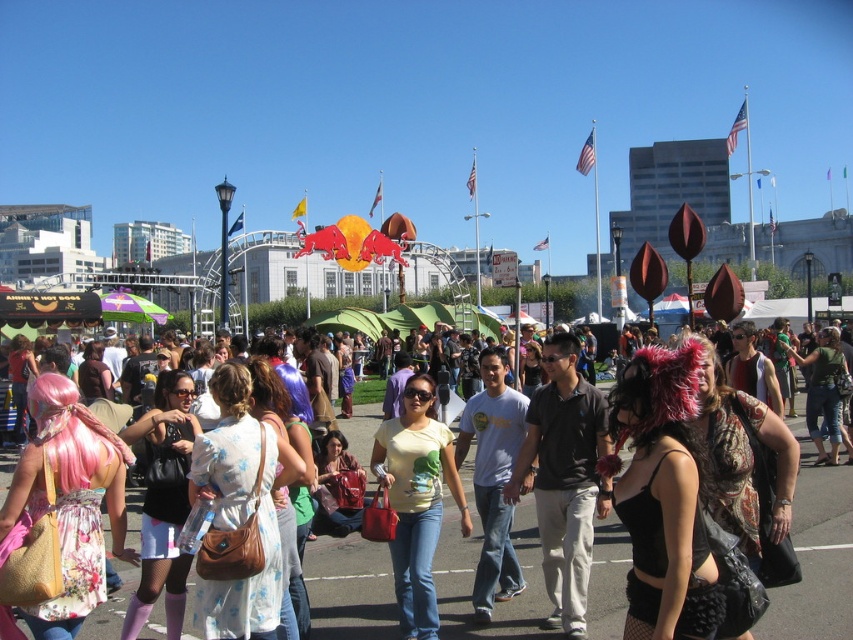
You are organizing a photo shoot and need to place two models wearing the dark gray polo shirt at center and the yellow matte shirt at center in a way that their outfits are clearly visible. Given their sizes, which model should you position closer to the camera to ensure their outfit details are captured well?

The dark gray polo shirt at center occupies less space than the yellow matte shirt at center. To ensure both outfits are clearly visible, position the model wearing the dark gray polo shirt at center closer to the camera since it is smaller and requires more focus to capture details, while the larger yellow matte shirt at center can be slightly farther back and still be visible.

You are a photographer at the event and want to take a photo of the floral dress at center. Your camera has a maximum range of 30 meters. Can you capture the dress from your current position?

The floral dress at center and camera are 31.34 meters apart, which exceeds the camera maximum range of 30 meters. You cannot capture the dress from your current position.

You are standing at the center of the event and see the point marked as point (816, 556). What is located at that point?

The floral dress at center is located at point (816, 556).